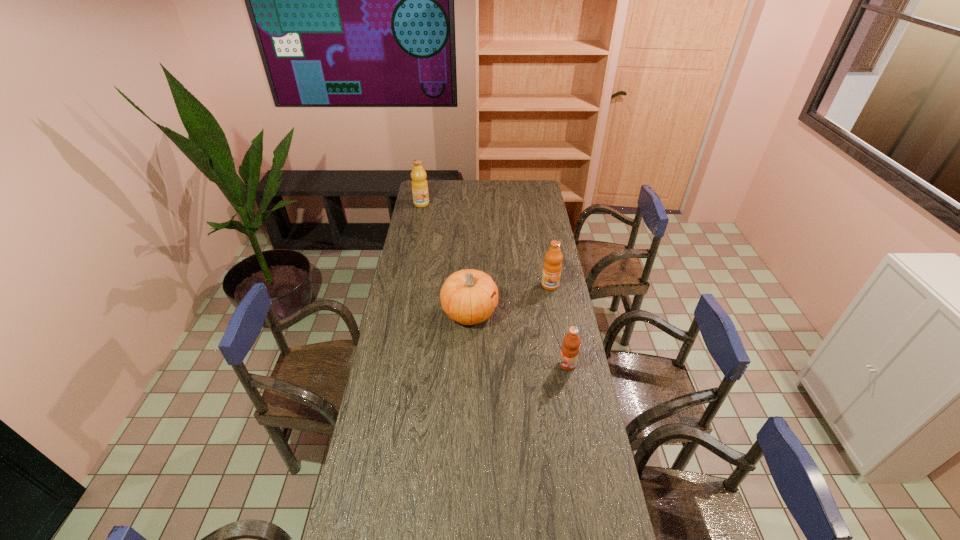
Where is `object that is the second closest one to the farthest object`? The image size is (960, 540). object that is the second closest one to the farthest object is located at coordinates (552, 267).

You are a GUI agent. You are given a task and a screenshot of the screen. Output one action in this format:
    pyautogui.click(x=<x>, y=<y>)
    Task: Click on the fruit juice that is the second closest one to the leftmost fruit juice
    
    Given the screenshot: What is the action you would take?
    tap(570, 348)

The image size is (960, 540). In order to click on the closest fruit juice relative to the third nearest object in this screenshot , I will do 570,348.

The height and width of the screenshot is (540, 960). What are the coordinates of `free space that satisfies the following two spatial constraints: 1. on the label side of the second nearest fruit juice; 2. on the front-facing side of the third object from right to left` in the screenshot? It's located at click(x=555, y=313).

Locate an element on the screen. vacant region that satisfies the following two spatial constraints: 1. on the label side of the second farthest fruit juice; 2. on the front-facing side of the pumpkin is located at coordinates (555, 313).

Where is `free spot that satisfies the following two spatial constraints: 1. on the label side of the third nearest object; 2. on the front-facing side of the pumpkin`? free spot that satisfies the following two spatial constraints: 1. on the label side of the third nearest object; 2. on the front-facing side of the pumpkin is located at coordinates (555, 313).